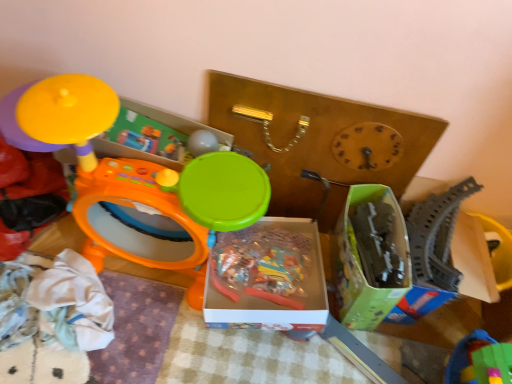
Locate an element on the screen. This screenshot has height=384, width=512. empty space that is ontop of gray plastic train track at right, which is the 4th toy in left-to-right order is located at coordinates (480, 241).